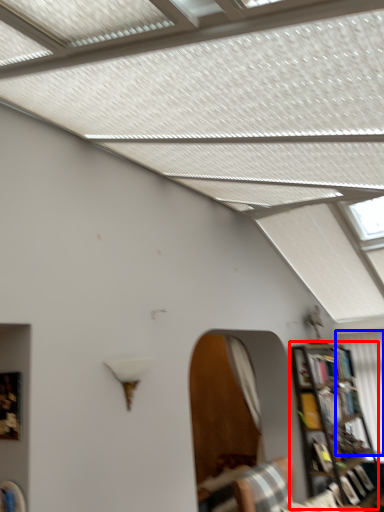
Question: Which object is closer to the camera taking this photo, bookcase (highlighted by a red box) or curtain (highlighted by a blue box)?

Choices:
 (A) bookcase
 (B) curtain

Answer: (A)